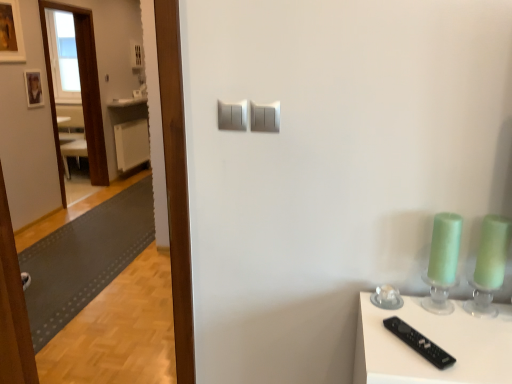
Question: From the image's perspective, relative to wooden picture frame at upper left, the 1th picture frame when ordered from front to back, is white plastic radiator at left above or below?

Choices:
 (A) above
 (B) below

Answer: (B)

Question: Is white plastic radiator at left wider or thinner than wooden picture frame at upper left, which is counted as the 1th picture frame, starting from the top?

Choices:
 (A) wide
 (B) thin

Answer: (A)

Question: Based on their relative distances, which object is farther from the white glossy counter top at upper left?

Choices:
 (A) green glass candle holder at right
 (B) satin silver light switch at upper center, the 1th light switch from the left
 (C) gray rubber mat at left
 (D) wooden picture frame at upper left, the 1th picture frame when ordered from front to back
 (E) satin silver switch at center, which is the second light switch from left to right

Answer: (A)

Question: Considering the real-world distances, which object is closest to the green glass candle holder at right?

Choices:
 (A) satin silver light switch at upper center, which is the second light switch in right-to-left order
 (B) black plastic remote at lower right
 (C) wooden photo frame at upper left, the first picture frame ordered from the bottom
 (D) satin silver switch at center, which is the second light switch from left to right
 (E) wooden picture frame at upper left, marked as the second picture frame in a bottom-to-top arrangement

Answer: (B)